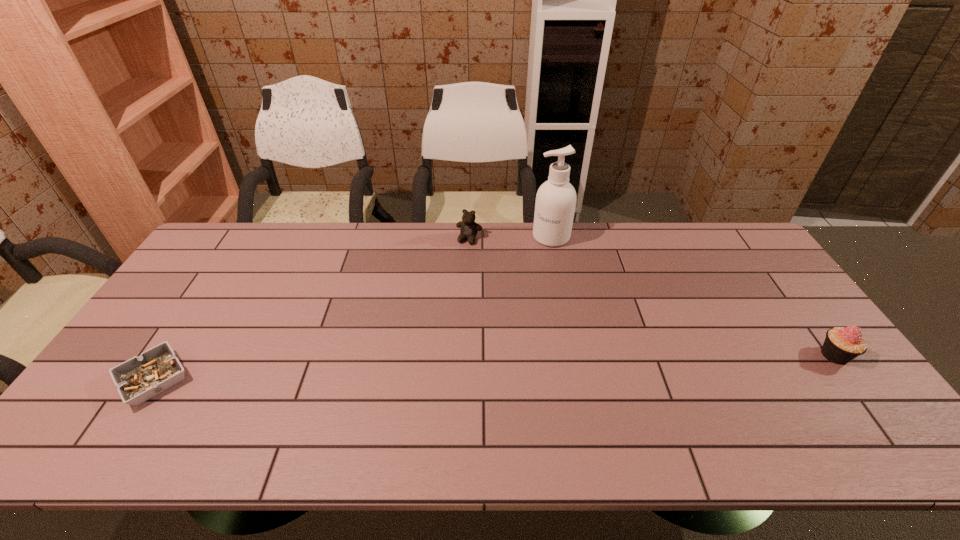
Where is `free spot on the desktop that is between the shortest object and the rightmost object and is positioned on the face of the teddy bear`? This screenshot has width=960, height=540. free spot on the desktop that is between the shortest object and the rightmost object and is positioned on the face of the teddy bear is located at coordinates (410, 370).

The image size is (960, 540). I want to click on free space on the desktop that is between the shortest object and the rightmost object and is positioned on the front label of the third object from left to right, so click(467, 368).